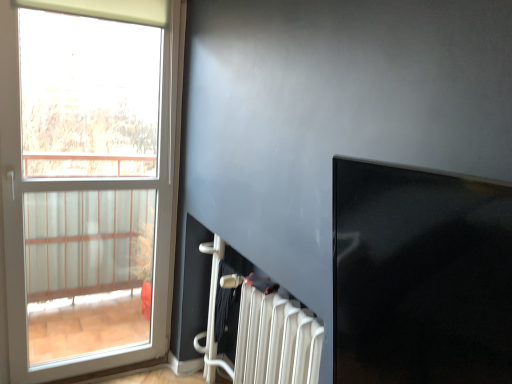
Question: Is white plastic radiator at lower center surrounded by transparent glass window screen at upper right?

Choices:
 (A) yes
 (B) no

Answer: (B)

Question: Is the surface of transparent glass window screen at upper right in direct contact with white plastic radiator at lower center?

Choices:
 (A) yes
 (B) no

Answer: (B)

Question: Can you confirm if transparent glass window screen at upper right is smaller than white plastic radiator at lower center?

Choices:
 (A) yes
 (B) no

Answer: (A)

Question: From a real-world perspective, is transparent glass window screen at upper right on white plastic radiator at lower center?

Choices:
 (A) yes
 (B) no

Answer: (A)

Question: Is transparent glass window screen at upper right to the right of white plastic radiator at lower center from the viewer's perspective?

Choices:
 (A) no
 (B) yes

Answer: (B)

Question: From the image's perspective, is transparent glass window screen at upper right positioned above or below white plastic radiator at lower center?

Choices:
 (A) above
 (B) below

Answer: (A)

Question: From a real-world perspective, is transparent glass window screen at upper right above or below white plastic radiator at lower center?

Choices:
 (A) above
 (B) below

Answer: (A)

Question: Considering the positions of transparent glass window screen at upper right and white plastic radiator at lower center in the image, is transparent glass window screen at upper right taller or shorter than white plastic radiator at lower center?

Choices:
 (A) tall
 (B) short

Answer: (B)

Question: Does point (504, 235) appear closer or farther from the camera than point (267, 296)?

Choices:
 (A) closer
 (B) farther

Answer: (A)

Question: Considering the positions of white plastic radiator at lower center and transparent glass window screen at upper right in the image, is white plastic radiator at lower center bigger or smaller than transparent glass window screen at upper right?

Choices:
 (A) small
 (B) big

Answer: (B)

Question: Is white plastic radiator at lower center situated inside transparent glass window screen at upper right or outside?

Choices:
 (A) outside
 (B) inside

Answer: (A)

Question: From a real-world perspective, is white plastic radiator at lower center positioned above or below transparent glass window screen at upper right?

Choices:
 (A) below
 (B) above

Answer: (A)

Question: From the image's perspective, is white plastic radiator at lower center located above or below transparent glass window screen at upper right?

Choices:
 (A) below
 (B) above

Answer: (A)

Question: From a real-world perspective, relative to white glass window at left, is white plastic radiator at lower center vertically above or below?

Choices:
 (A) above
 (B) below

Answer: (B)

Question: From their relative heights in the image, would you say white plastic radiator at lower center is taller or shorter than white glass window at left?

Choices:
 (A) tall
 (B) short

Answer: (B)